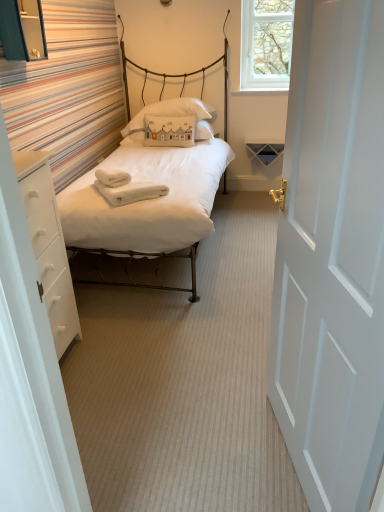
At what (x,y) coordinates should I click in order to perform the action: click on free spot to the left of white painted wood door at right. Please return your answer as a coordinate pair (x, y). Looking at the image, I should click on (206, 451).